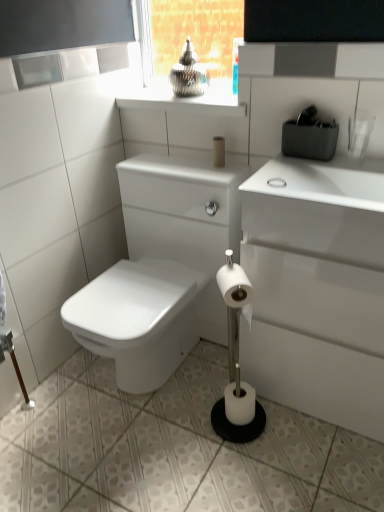
You are a GUI agent. You are given a task and a screenshot of the screen. Output one action in this format:
    pyautogui.click(x=<x>, y=<y>)
    Task: Click on the vacant space in front of white glossy toilet at lower left
    
    Given the screenshot: What is the action you would take?
    pyautogui.click(x=155, y=462)